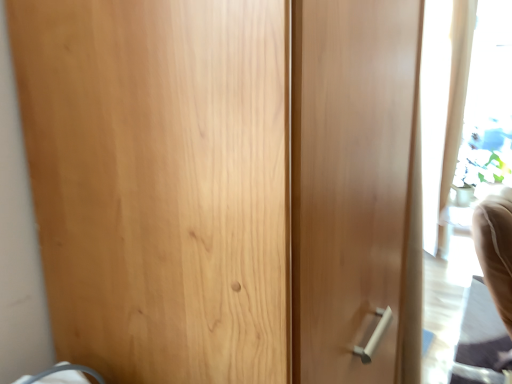
Question: Should I look upward or downward to see white sheer curtain at right?

Choices:
 (A) down
 (B) up

Answer: (B)